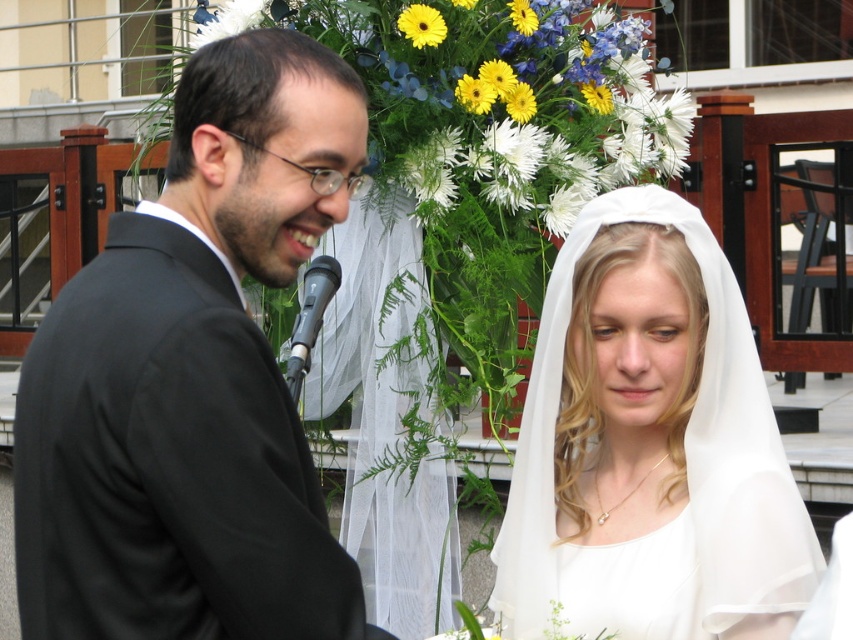
The image size is (853, 640). Describe the element at coordinates (193, 380) in the screenshot. I see `black matte suit at left` at that location.

Who is more distant from viewer, (180,490) or (294,326)?

The point (294,326) is more distant.

Locate an element on the screen. The height and width of the screenshot is (640, 853). black matte suit at left is located at coordinates (193, 380).

This screenshot has height=640, width=853. Identify the location of black matte suit at left. (193, 380).

At what (x,y) coordinates should I click in order to perform the action: click on white sheer veil at center. Please return your answer as a coordinate pair (x, y). Image resolution: width=853 pixels, height=640 pixels. Looking at the image, I should click on (648, 445).

Is point (627, 320) positioned in front of point (302, 371)?

Yes, point (627, 320) is in front of point (302, 371).

Measure the distance between point (x=699, y=609) and camera.

Point (x=699, y=609) is 10.83 feet from camera.

I want to click on white sheer veil at center, so click(648, 445).

Is black matte suit at left further to camera compared to white sheer veil at center?

No.

Which of these two, black matte suit at left or white sheer veil at center, stands taller?

black matte suit at left is taller.

Between point (93, 586) and point (612, 333), which one is positioned in front?

Point (93, 586)

The height and width of the screenshot is (640, 853). In order to click on black matte suit at left in this screenshot , I will do `click(193, 380)`.